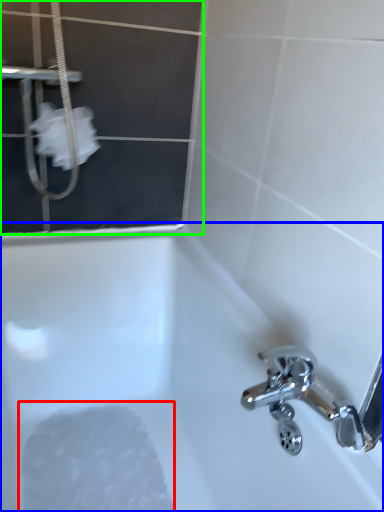
Question: Which is farther away from foam (highlighted by a red box)? bathtub (highlighted by a blue box) or screen door (highlighted by a green box)?

Choices:
 (A) bathtub
 (B) screen door

Answer: (B)